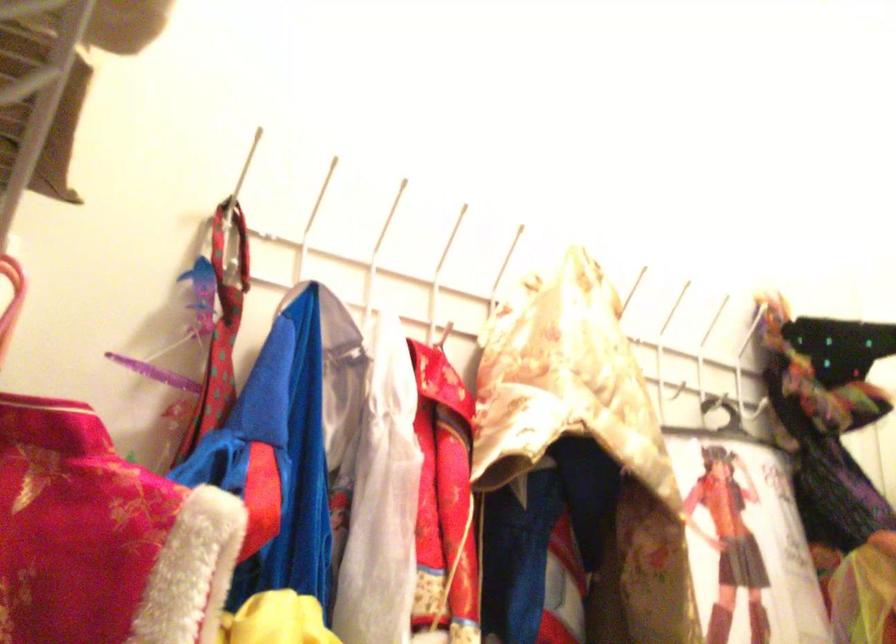
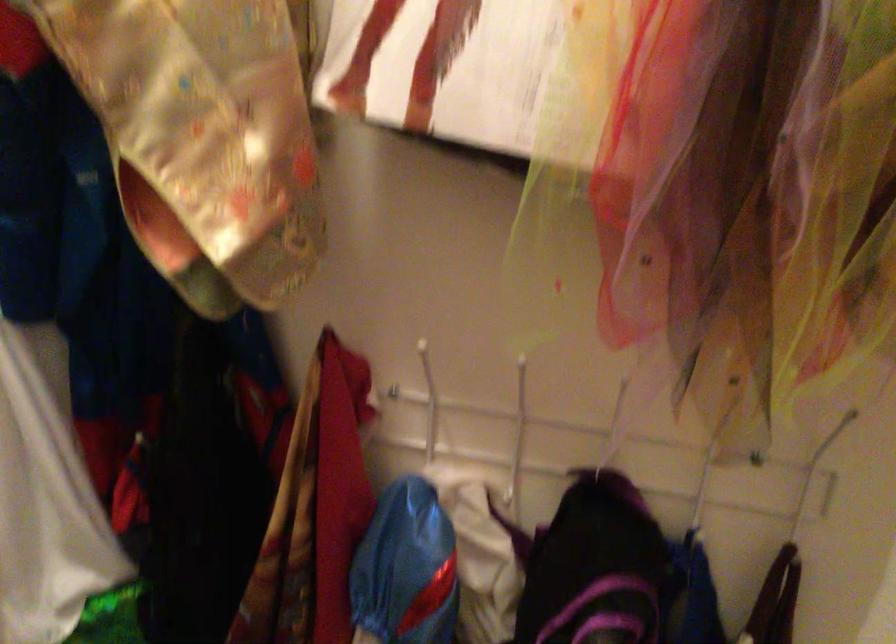
First-person continuous shooting, in which direction is the camera rotating?

The rotation direction of the camera is left-down.